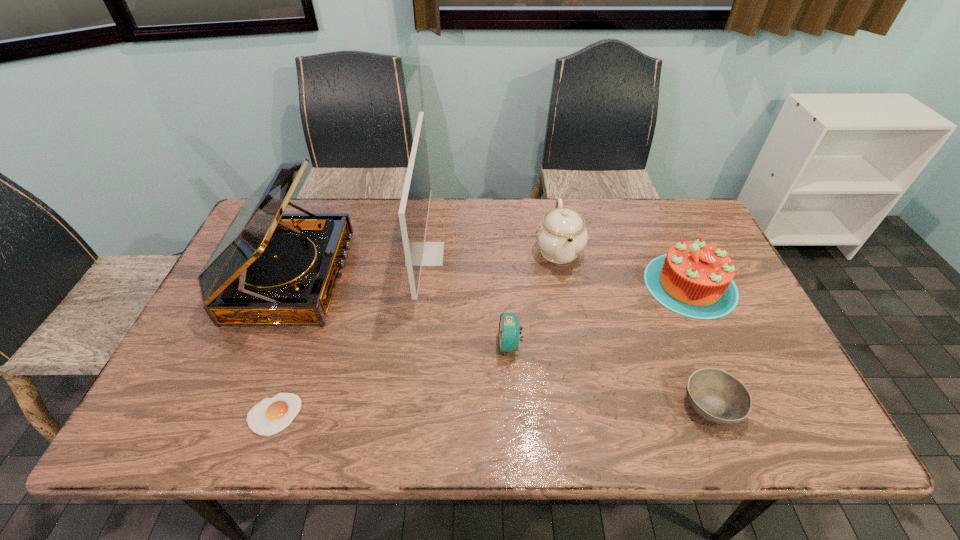
You are a GUI agent. You are given a task and a screenshot of the screen. Output one action in this format:
    pyautogui.click(x=<x>, y=<y>)
    Task: Click on the blank space located 0.110m at the spout of the chinaware
    The width and height of the screenshot is (960, 540).
    Given the screenshot: What is the action you would take?
    (x=569, y=307)

At what (x,y) coordinates should I click in order to perform the action: click on free region located on the front of the cake. Please return your answer as a coordinate pair (x, y). The width and height of the screenshot is (960, 540). Looking at the image, I should click on (736, 387).

Find the location of a particular element. The width and height of the screenshot is (960, 540). vacant space located 0.180m on the front-facing side of the alarm clock is located at coordinates (426, 345).

Locate an element on the screen. vacant space located 0.180m on the front-facing side of the alarm clock is located at coordinates (426, 345).

The height and width of the screenshot is (540, 960). What are the coordinates of `free space located on the front-facing side of the alarm clock` in the screenshot? It's located at (439, 345).

I want to click on free space located on the left of the bowl, so click(x=656, y=404).

This screenshot has height=540, width=960. Find the location of `vacant space positioned on the back of the shortest object`. vacant space positioned on the back of the shortest object is located at coordinates (314, 299).

You are a GUI agent. You are given a task and a screenshot of the screen. Output one action in this format:
    pyautogui.click(x=<x>, y=<y>)
    Task: Click on the monitor located at the far edge
    
    Given the screenshot: What is the action you would take?
    pyautogui.click(x=413, y=212)

You are a GUI agent. You are given a task and a screenshot of the screen. Output one action in this format:
    pyautogui.click(x=<x>, y=<y>)
    Task: Click on the record player at the far edge
    This screenshot has width=960, height=540.
    Given the screenshot: What is the action you would take?
    pyautogui.click(x=269, y=269)

The image size is (960, 540). What are the coordinates of `chinaware that is at the far edge` in the screenshot? It's located at (561, 235).